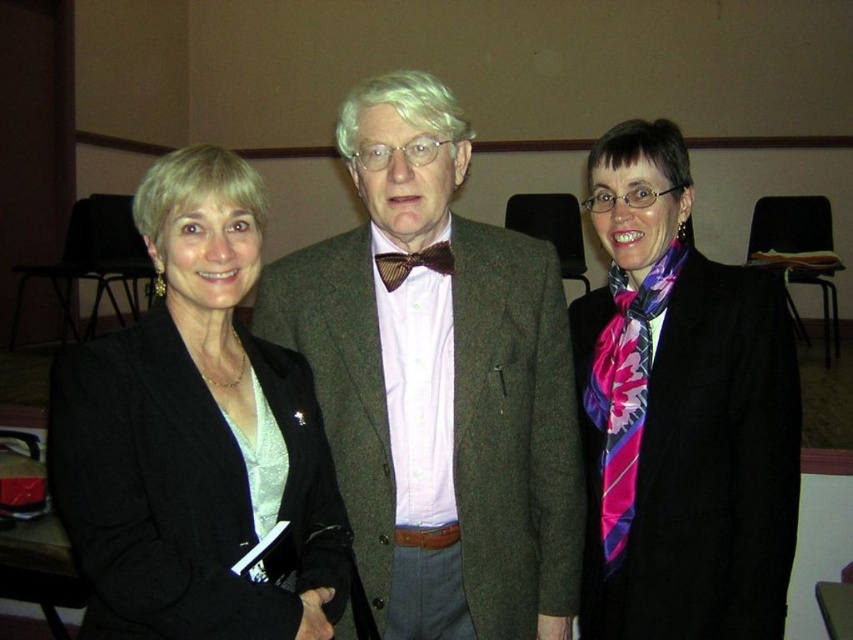
In the scene shown: You are a tailor measuring the distance between the brown woolen suit at center and the brown textured bow tie at center for a custom fitting. The minimum required space for proper adjustment is 8 inches. Can the current spacing accommodate the adjustment?

The distance between the brown woolen suit at center and the brown textured bow tie at center is 9.30 inches, which exceeds the minimum required 8 inches. Therefore, the current spacing can accommodate the adjustment.

You are standing in the conference room and want to determine which of the two points, point (201, 307) or point (392, 259), is closer to you. Based on the image, which point is nearer?

Point (201, 307) is closer to the camera than point (392, 259), so it is the nearer point.